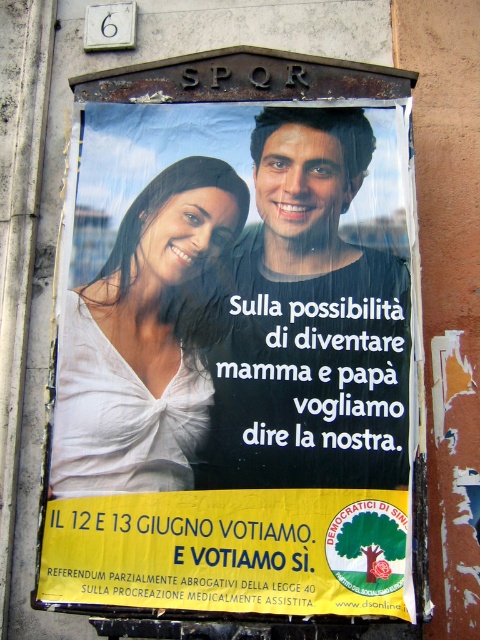
Question: Which point appears closest to the camera in this image?

Choices:
 (A) (230, 352)
 (B) (72, 326)
 (C) (157, 371)

Answer: (C)

Question: Is white fabric poster at center thinner than white satin blouse at upper left?

Choices:
 (A) yes
 (B) no

Answer: (B)

Question: Which point is closer to the camera taking this photo?

Choices:
 (A) (67, 472)
 (B) (252, 422)

Answer: (B)

Question: Does white fabric poster at center appear on the left side of matte black shirt at center?

Choices:
 (A) yes
 (B) no

Answer: (A)

Question: Among these objects, which one is nearest to the camera?

Choices:
 (A) white satin blouse at upper left
 (B) white fabric poster at center
 (C) matte black shirt at center

Answer: (B)

Question: Is white fabric poster at center positioned behind matte black shirt at center?

Choices:
 (A) no
 (B) yes

Answer: (A)